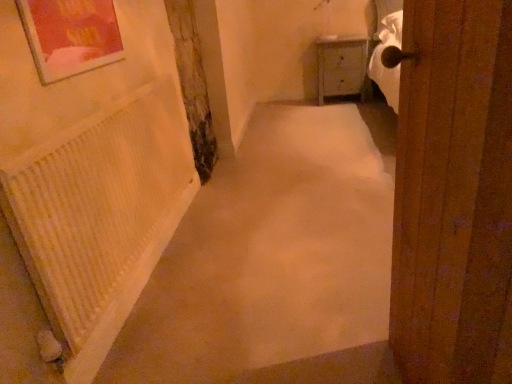
Question: Is wooden door at right situated inside beige carpet at center or outside?

Choices:
 (A) outside
 (B) inside

Answer: (A)

Question: In the image, is wooden door at right positioned in front of or behind beige carpet at center?

Choices:
 (A) behind
 (B) front

Answer: (B)

Question: Which of these objects is positioned closest to the wooden door at right?

Choices:
 (A) white textured radiator at left
 (B) white wood cabinet at upper right
 (C) beige carpet at center

Answer: (C)

Question: Which object is positioned farthest from the wooden door at right?

Choices:
 (A) beige carpet at center
 (B) white textured radiator at left
 (C) white wood cabinet at upper right

Answer: (C)